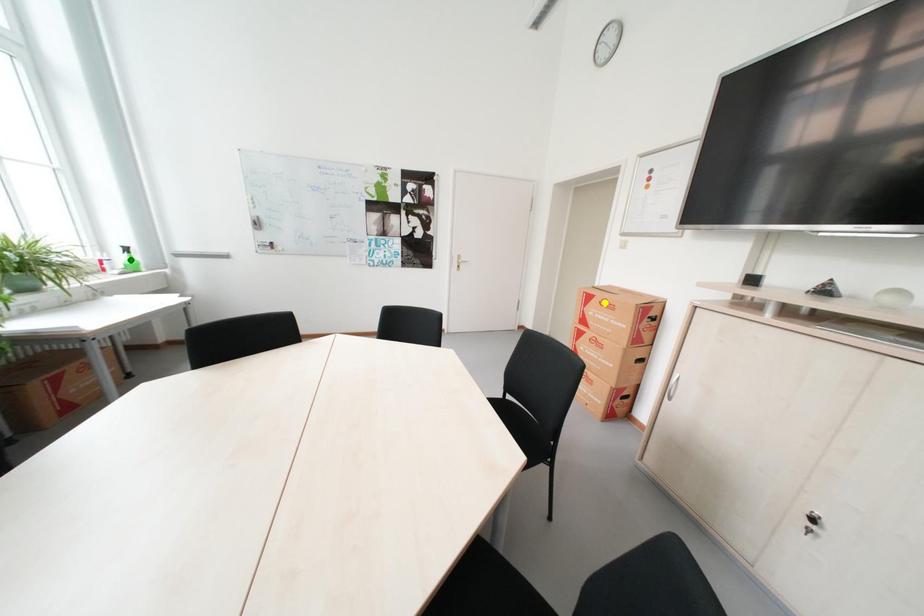
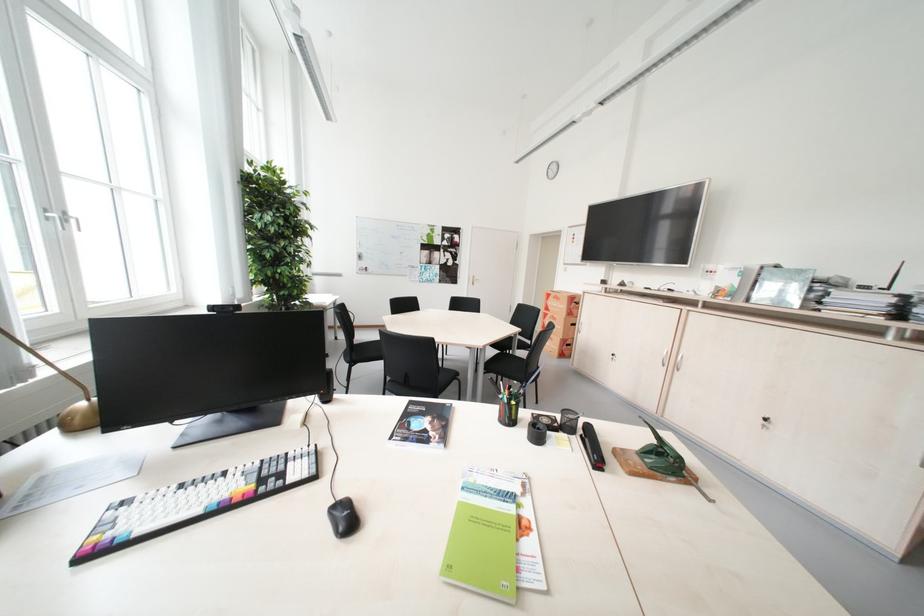
I am providing you with two images of the same scene from different viewpoints. Three points are marked in image1. Which point corresponds to a part or object that is occluded in image2?In image1, three points are marked. Which of them correspond to a part or object that is occluded in image2?Among the three points shown in image1, which one corresponds to a part or object that is no longer visible due to occlusion in image2?

blue point, green point